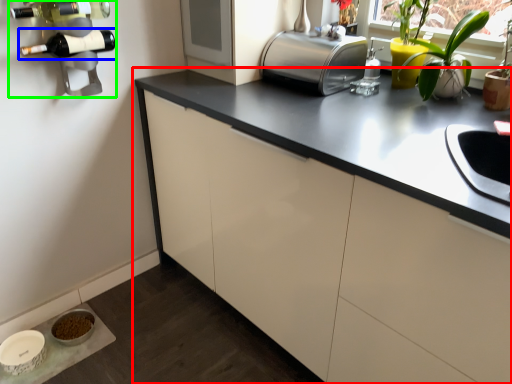
Question: Based on their relative distances, which object is nearer to cabinetry (highlighted by a red box)? Choose from wine bottle (highlighted by a blue box) and wine rack (highlighted by a green box).

Choices:
 (A) wine bottle
 (B) wine rack

Answer: (B)